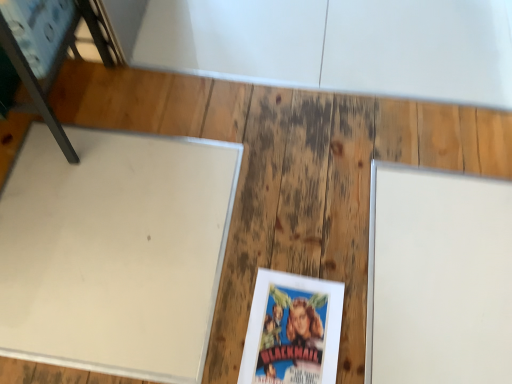
Where is `blank area beneath white matte board at left (from a real-world perspective)`? blank area beneath white matte board at left (from a real-world perspective) is located at coordinates (110, 240).